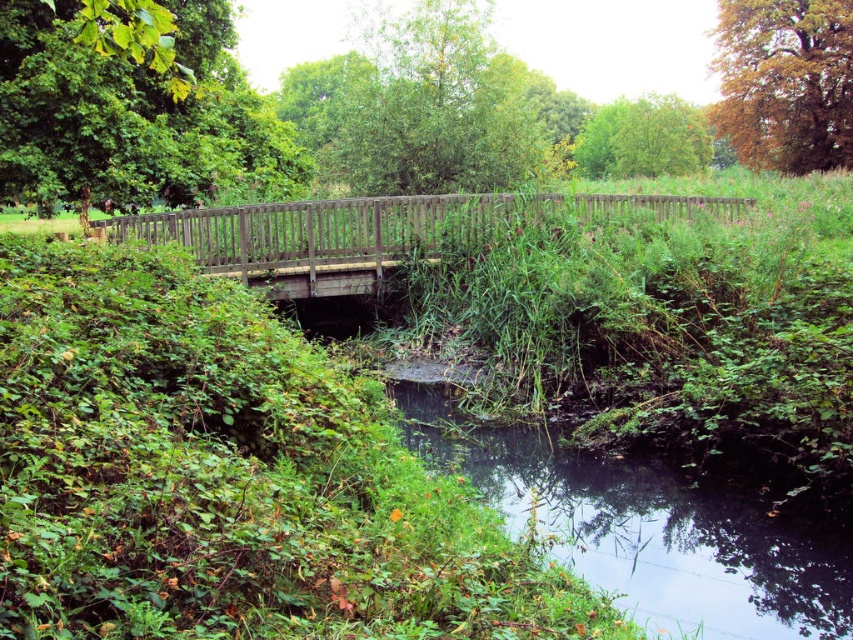
Does green grassy river at lower center have a smaller size compared to golden-brown textured tree at upper right?

Indeed, green grassy river at lower center has a smaller size compared to golden-brown textured tree at upper right.

Locate an element on the screen. This screenshot has height=640, width=853. green grassy river at lower center is located at coordinates (651, 529).

Is point (399, 403) positioned in front of point (772, 42)?

Yes, point (399, 403) is closer to viewer.

You are a GUI agent. You are given a task and a screenshot of the screen. Output one action in this format:
    pyautogui.click(x=<x>, y=<y>)
    Task: Click on the green grassy river at lower center
    Image resolution: width=853 pixels, height=640 pixels.
    Given the screenshot: What is the action you would take?
    pyautogui.click(x=651, y=529)

Can you confirm if green grassy river at lower center is thinner than wooden bridge at center?

Yes, green grassy river at lower center is thinner than wooden bridge at center.

Does green grassy river at lower center have a smaller size compared to wooden bridge at center?

Yes.

Locate an element on the screen. Image resolution: width=853 pixels, height=640 pixels. green grassy river at lower center is located at coordinates (651, 529).

At what (x,y) coordinates should I click in order to perform the action: click on green grassy river at lower center. Please return your answer as a coordinate pair (x, y). This screenshot has height=640, width=853. Looking at the image, I should click on (651, 529).

Where is `green matte tree at upper left`? The image size is (853, 640). green matte tree at upper left is located at coordinates (134, 116).

Does green matte tree at upper left have a lesser height compared to golden-brown textured tree at upper right?

Indeed, green matte tree at upper left has a lesser height compared to golden-brown textured tree at upper right.

Is point (238, 180) farther from viewer compared to point (851, 1)?

No.

Find the location of a particular element. This screenshot has height=640, width=853. green matte tree at upper left is located at coordinates (134, 116).